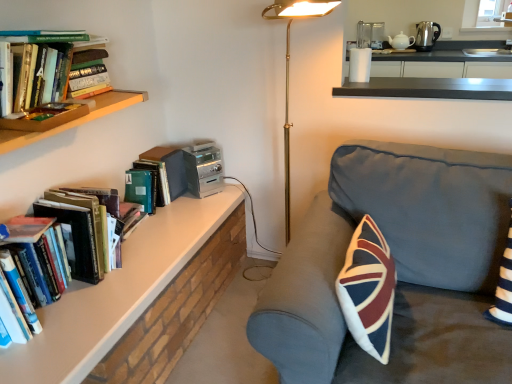
Find the location of `vacant area in front of hardcover book at upper left, the 1th book viewed from the back`. vacant area in front of hardcover book at upper left, the 1th book viewed from the back is located at coordinates (162, 225).